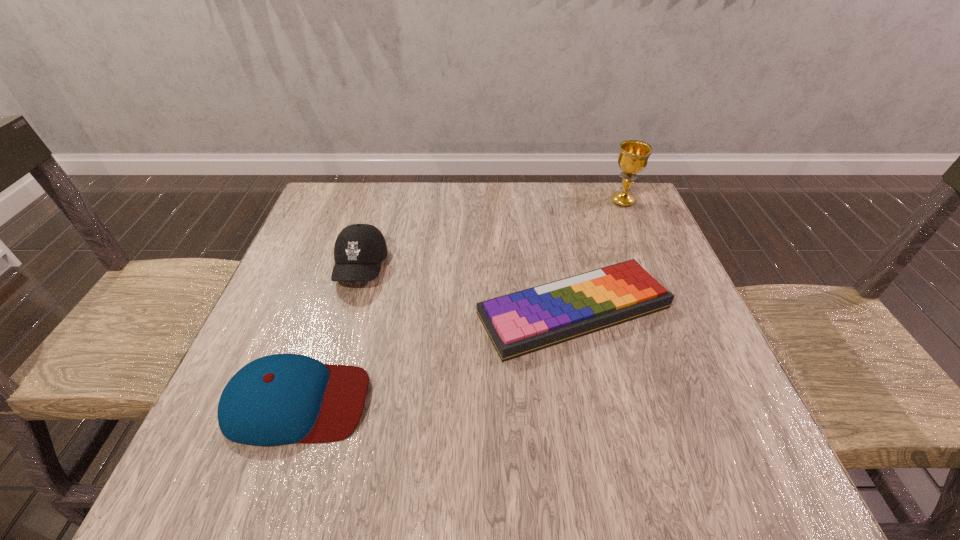
The width and height of the screenshot is (960, 540). Identify the location of free spot between the farther baseball cap and the second shortest object. (328, 335).

Image resolution: width=960 pixels, height=540 pixels. In order to click on vacant space that's between the shortest object and the chalice in this screenshot , I will do `click(598, 256)`.

Where is `vacant area between the third tallest object and the farthest object`? The height and width of the screenshot is (540, 960). vacant area between the third tallest object and the farthest object is located at coordinates (460, 301).

Where is `vacant area between the shortest object and the farther baseball cap`? vacant area between the shortest object and the farther baseball cap is located at coordinates (468, 289).

At what (x,y) coordinates should I click in order to perform the action: click on object that is the second closest to the nearer baseball cap. Please return your answer as a coordinate pair (x, y). The width and height of the screenshot is (960, 540). Looking at the image, I should click on (520, 323).

The image size is (960, 540). I want to click on object that is the second closest to the taller baseball cap, so point(520,323).

At what (x,y) coordinates should I click in order to perform the action: click on free location that satisfies the following two spatial constraints: 1. on the front-facing side of the taller baseball cap; 2. with the bill of the nearer baseball cap facing forward. Please return your answer as a coordinate pair (x, y). Looking at the image, I should click on (321, 402).

This screenshot has width=960, height=540. In order to click on free location that satisfies the following two spatial constraints: 1. on the front-facing side of the farther baseball cap; 2. with the bill of the nearer baseball cap facing forward in this screenshot , I will do 321,402.

The width and height of the screenshot is (960, 540). I want to click on vacant space that satisfies the following two spatial constraints: 1. on the back side of the computer keyboard; 2. on the right side of the tallest object, so click(x=551, y=201).

Where is `free spot that satisfies the following two spatial constraints: 1. on the front-facing side of the shortest object; 2. on the left side of the farther baseball cap`? The width and height of the screenshot is (960, 540). free spot that satisfies the following two spatial constraints: 1. on the front-facing side of the shortest object; 2. on the left side of the farther baseball cap is located at coordinates (348, 310).